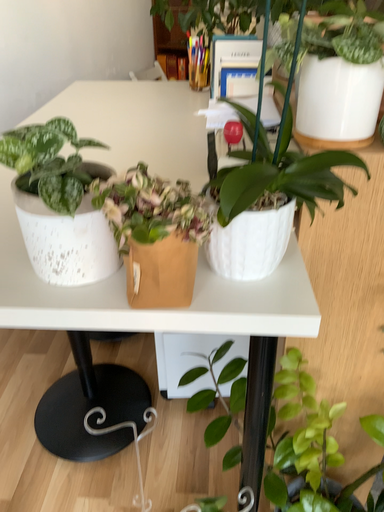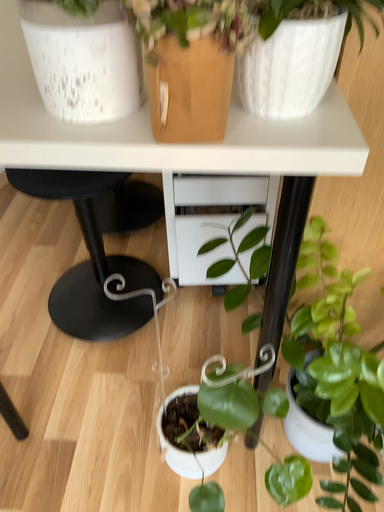
Question: Which way did the camera rotate in the video?

Choices:
 (A) rotated downward
 (B) rotated upward

Answer: (A)